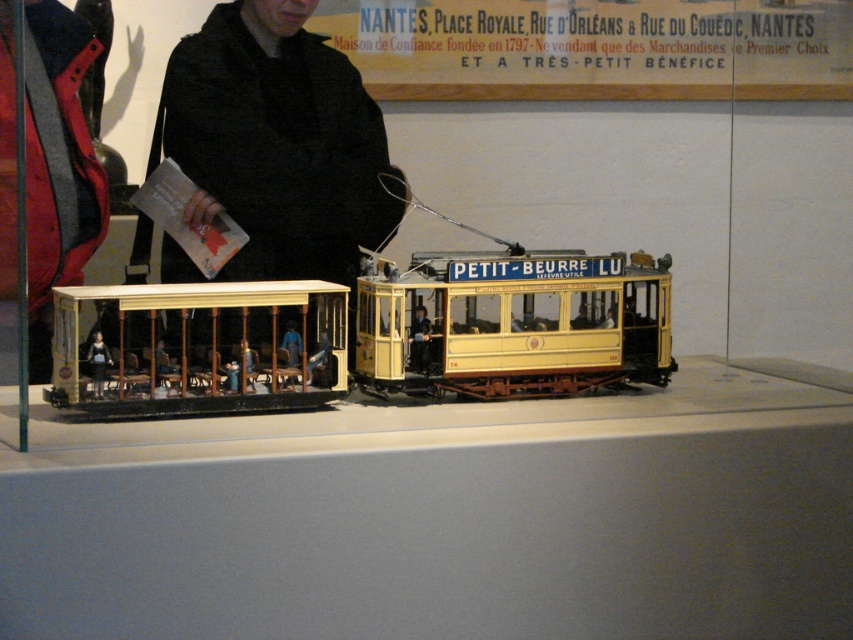
You are standing in front of the display case with the two miniature streetcars. You want to take a photo of the point at coordinate [355,106]. If your camera is 2.66 meters away from the point, is it within the recommended 3 meter safety distance for capturing clear images without distortion?

The point at coordinate [355,106] is 2.66 meters away from the camera, which is within the recommended 3 meter safety distance. Therefore, the camera is close enough to capture a clear image without distortion.

You are a photographer standing at the camera position. You want to take a photo of the black fabric at center. Can you focus on it without adjusting the camera focus? The camera has a minimum focus distance of 2 meters.

The black fabric at center and camera are 2.41 meters apart from each other. Since the minimum focus distance is 2 meters, the camera can focus on the black fabric at center as the distance is within range.